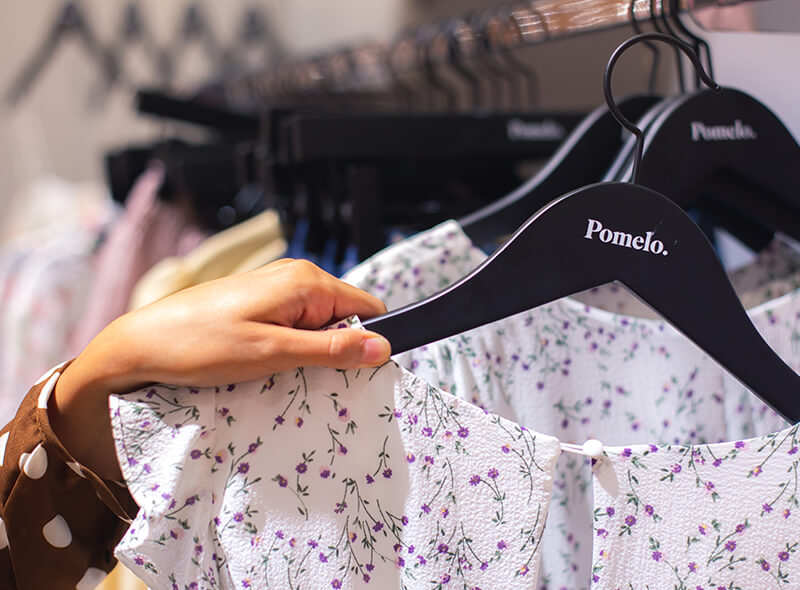
Find the location of `hand grabbing hanger`. hand grabbing hanger is located at coordinates (261, 301).